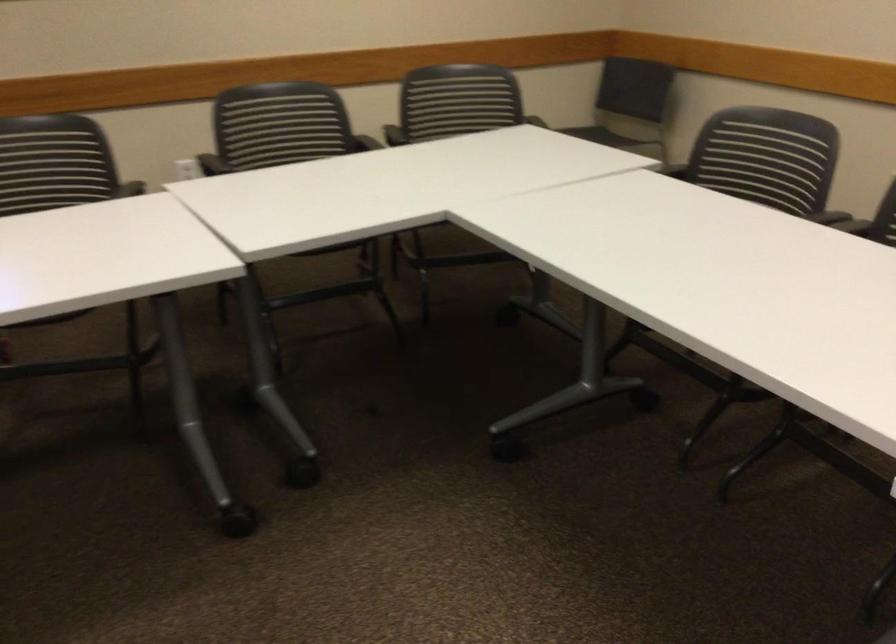
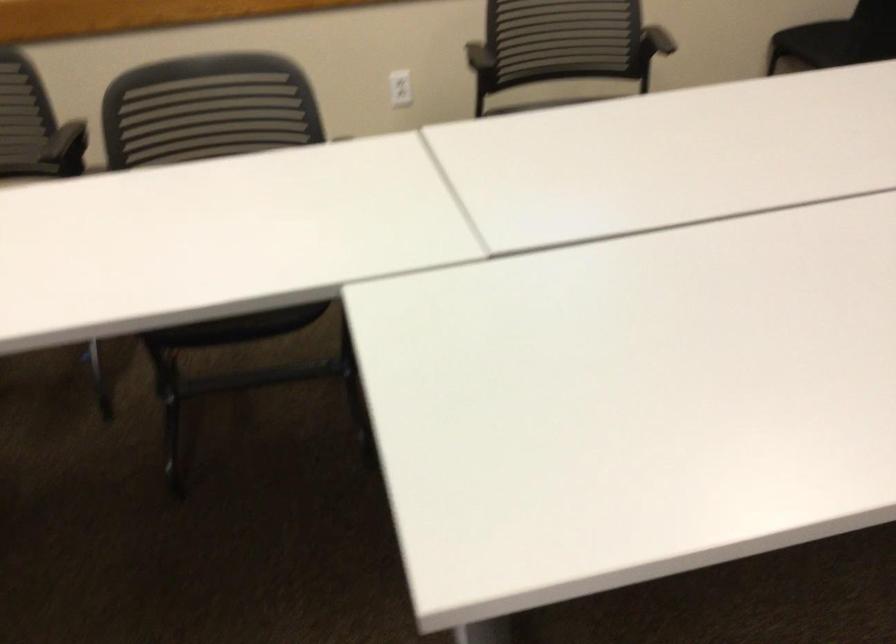
Consider the image. How did the camera likely rotate?

The camera rotated toward right-down.